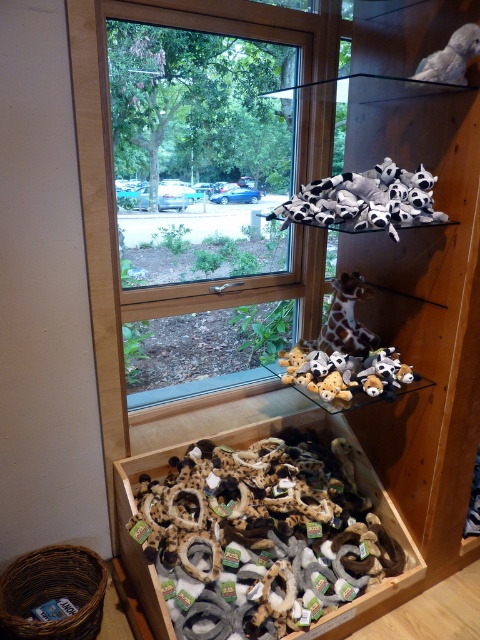
Question: Is the position of soft plush toys at lower center more distant than that of white plush toy at upper right?

Choices:
 (A) no
 (B) yes

Answer: (B)

Question: Which object is the closest to the white plush toy at upper right?

Choices:
 (A) black plush toys at upper center
 (B) soft plush toys at center
 (C) soft plush toys at lower center
 (D) clear glass window at upper center

Answer: (A)

Question: Is clear glass window at upper center smaller than black plush toys at upper center?

Choices:
 (A) yes
 (B) no

Answer: (B)

Question: Is clear glass window at upper center to the left of black plush toys at upper center from the viewer's perspective?

Choices:
 (A) no
 (B) yes

Answer: (B)

Question: Estimate the real-world distances between objects in this image. Which object is closer to the clear glass window at upper center?

Choices:
 (A) white plush toy at upper right
 (B) soft plush toys at center

Answer: (B)

Question: Which of the following is the closest to the observer?

Choices:
 (A) (309, 372)
 (B) (208, 600)

Answer: (B)